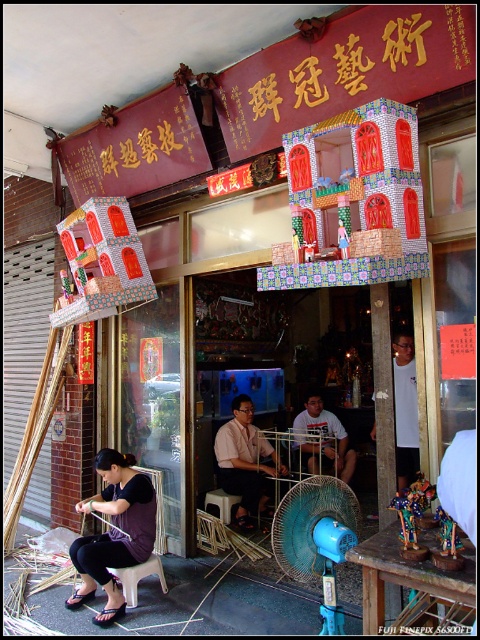
You are standing in front of the shop and want to take a photo of the point at coordinate point (332, 600). If your camera has a focal length of 50mm and you are 2.80 meters away from the point, what is the required distance between the camera and the point to achieve a 10cm wide image of the point on the sensor?

The point at coordinate point (332, 600) is 2.80 meters away from the camera. To achieve a 10cm wide image on the sensor with a 50mm focal length, the required distance can be calculated using the formula distance_sensor_image_width. However, since the current distance is already 2.80 meters, no adjustment is needed if the sensor size matches the calculation. Please ensure the sensor width aligns with the formula requirements.

Looking at this image, you are a customer entering this shop and want to read the goldmetalsignboard at upper center. However, you notice the matte purple dress at lower left is blocking your view. Can you move the dress to the right to see the signboard clearly?

The matte purple dress at lower left is already positioned to the left of the goldmetalsignboard at upper center, so moving it further to the right would not obstruct the view. You can move the dress to the right to see the signboard clearly.

You are a customer standing at the entrance of the shop. You want to reach the goldmetalsignboard at upper center to read its inscription. However, there is a matte purple dress at lower left blocking your path. Can you walk around it to reach the signboard?

The matte purple dress at lower left is 6.69 feet away from the goldmetalsignboard at upper center. Since the dress is blocking the path, you can walk around it to reach the signboard as there is enough space between them.